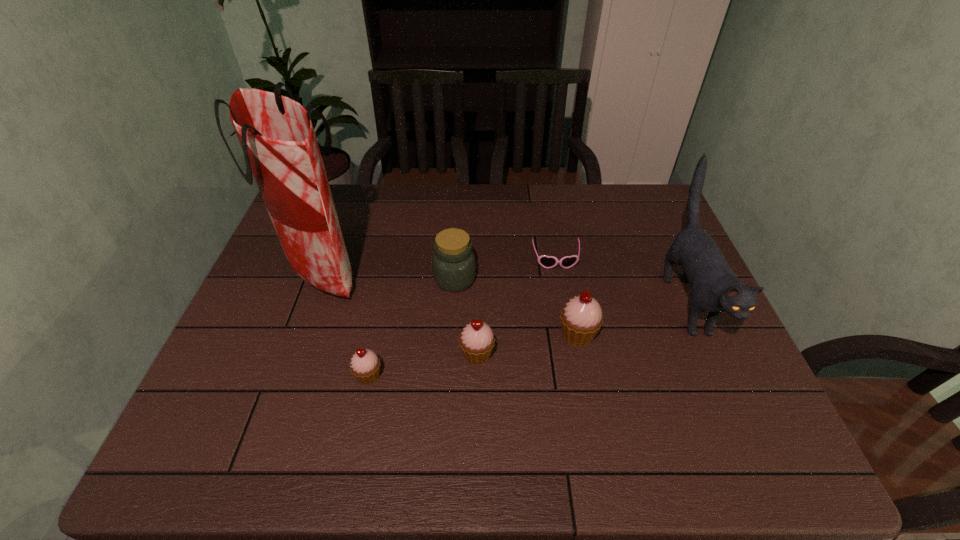
Where is `object that is at the right edge`? This screenshot has width=960, height=540. object that is at the right edge is located at coordinates (716, 289).

This screenshot has height=540, width=960. What are the coordinates of `vacant space at the far edge of the desktop` in the screenshot? It's located at (449, 210).

Locate an element on the screen. The width and height of the screenshot is (960, 540). vacant space at the near edge of the desktop is located at coordinates (553, 409).

Find the location of `free space at the left edge of the desktop`. free space at the left edge of the desktop is located at coordinates (251, 308).

Locate an element on the screen. This screenshot has height=540, width=960. vacant space at the right edge of the desktop is located at coordinates click(x=639, y=247).

This screenshot has height=540, width=960. In the image, there is a desktop. Identify the location of free space at the near left corner. (256, 411).

Locate an element on the screen. vacant space at the far right corner of the desktop is located at coordinates (641, 208).

You are a GUI agent. You are given a task and a screenshot of the screen. Output one action in this format:
    pyautogui.click(x=<x>, y=<y>)
    Task: Click on the free space between the sunglasses and the second cupcake from left to right
    
    Given the screenshot: What is the action you would take?
    pyautogui.click(x=516, y=307)

In order to click on empty space between the sunglasses and the second tallest object in this screenshot , I will do `click(621, 281)`.

This screenshot has height=540, width=960. I want to click on vacant area that lies between the leftmost cupcake and the shortest object, so click(x=462, y=318).